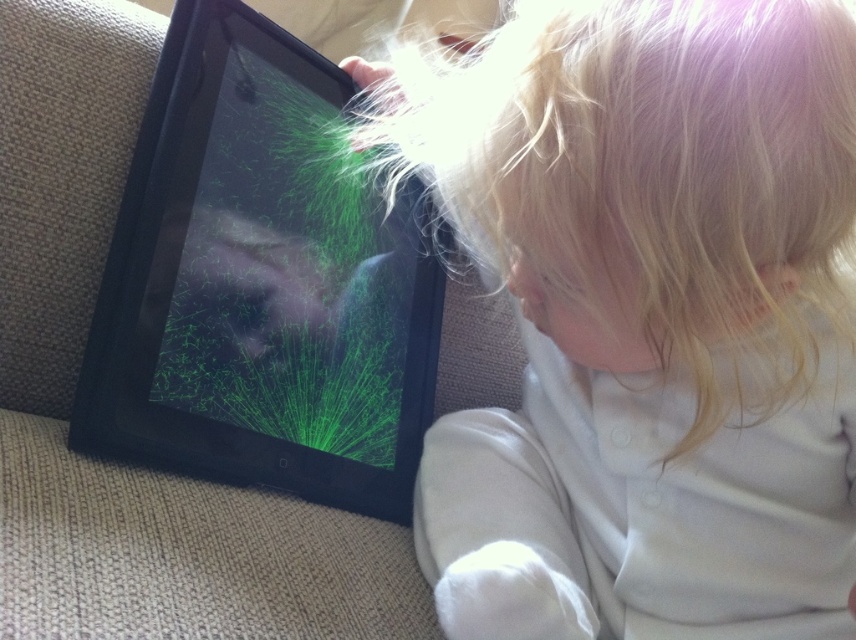
Question: Which point is farther to the camera?

Choices:
 (A) black matte tablet at center
 (B) blonde hair at upper right

Answer: (A)

Question: Does blonde hair at upper right have a greater width compared to black matte tablet at center?

Choices:
 (A) yes
 (B) no

Answer: (A)

Question: Does blonde hair at upper right have a greater width compared to black matte tablet at center?

Choices:
 (A) no
 (B) yes

Answer: (B)

Question: Which of the following is the closest to the observer?

Choices:
 (A) (663, 477)
 (B) (372, 420)

Answer: (A)

Question: Does blonde hair at upper right lie in front of black matte tablet at center?

Choices:
 (A) no
 (B) yes

Answer: (B)

Question: Which object is farther from the camera taking this photo?

Choices:
 (A) black matte tablet at center
 (B) blonde hair at upper right

Answer: (A)